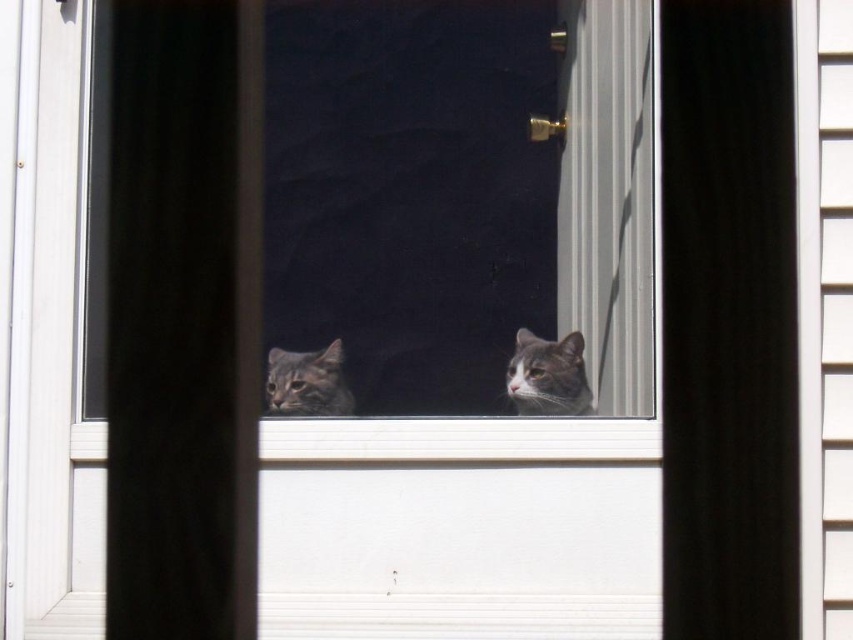
Question: Observing the image, what is the correct spatial positioning of gray soft fur cat at center in reference to tabby fur cat at center?

Choices:
 (A) right
 (B) left

Answer: (A)

Question: Estimate the real-world distances between objects in this image. Which object is closer to the white plastic window sill at lower center?

Choices:
 (A) gray soft fur cat at center
 (B) tabby fur cat at center

Answer: (A)

Question: Considering the relative positions of white plastic window sill at lower center and tabby fur cat at center in the image provided, where is white plastic window sill at lower center located with respect to tabby fur cat at center?

Choices:
 (A) below
 (B) above

Answer: (A)

Question: Considering the relative positions of white plastic window sill at lower center and tabby fur cat at center in the image provided, where is white plastic window sill at lower center located with respect to tabby fur cat at center?

Choices:
 (A) below
 (B) above

Answer: (A)

Question: Which of the following is the farthest from the observer?

Choices:
 (A) (386, 440)
 (B) (271, 364)
 (C) (517, 362)

Answer: (B)

Question: Considering the real-world distances, which object is closest to the white plastic window sill at lower center?

Choices:
 (A) tabby fur cat at center
 (B) gray soft fur cat at center

Answer: (B)